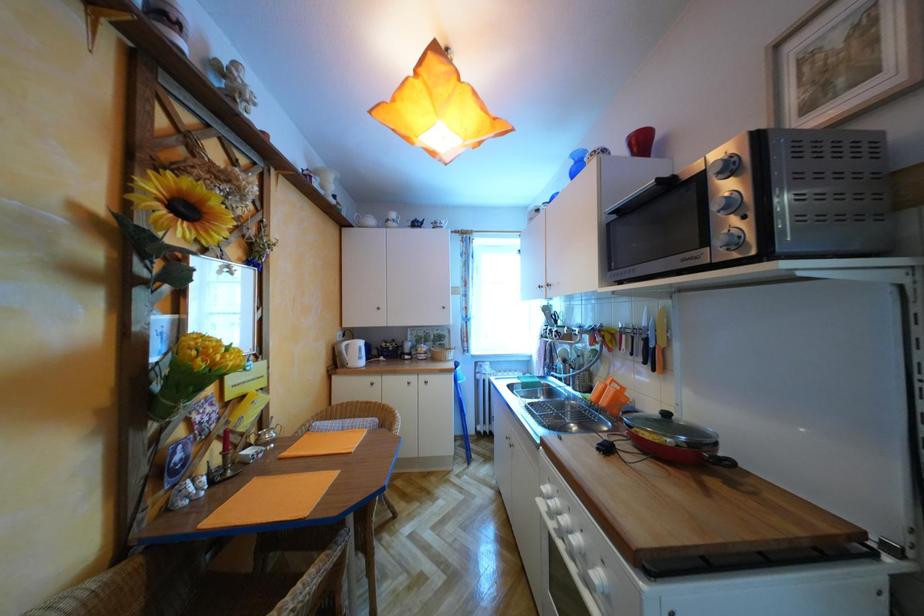
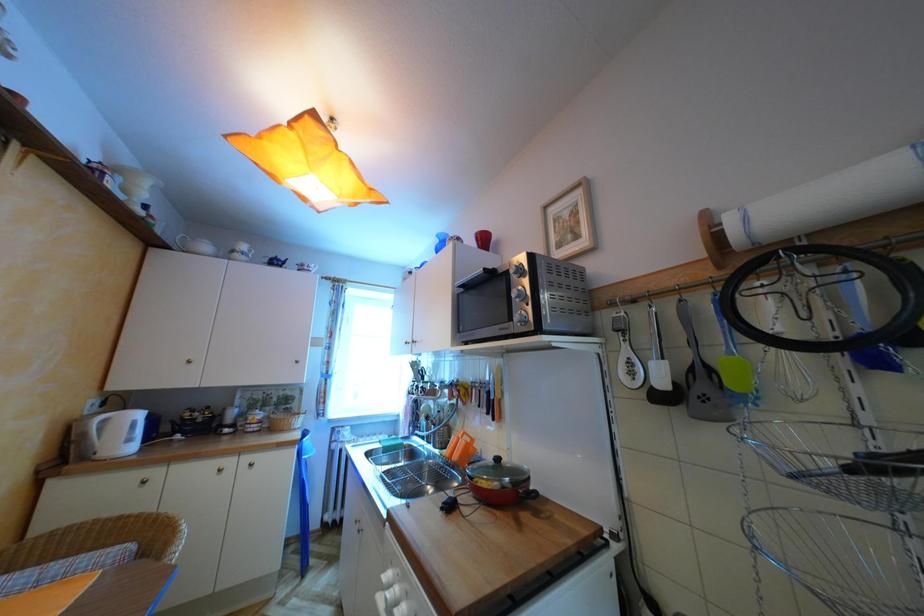
Question: The camera is either moving clockwise (left) or counter-clockwise (right) around the object. The first image is from the beginning of the video and the second image is from the end. Is the camera moving left or right when shooting the video?

Choices:
 (A) Left
 (B) Right

Answer: (A)